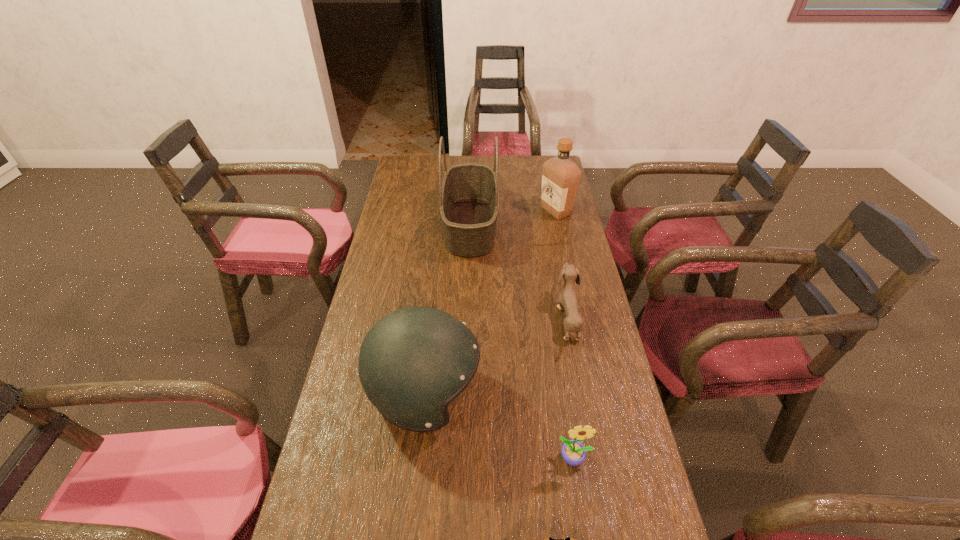
The height and width of the screenshot is (540, 960). What are the coordinates of `free space located 0.080m on the front-facing side of the sunflower` in the screenshot? It's located at (582, 508).

The width and height of the screenshot is (960, 540). Identify the location of free location located at the face of the third farthest object. (491, 319).

You are a GUI agent. You are given a task and a screenshot of the screen. Output one action in this format:
    pyautogui.click(x=<x>, y=<y>)
    Task: Click on the blank space located at the face of the third farthest object
    The width and height of the screenshot is (960, 540).
    Given the screenshot: What is the action you would take?
    pyautogui.click(x=474, y=319)

Where is `free space located 0.140m at the face of the third farthest object`? The image size is (960, 540). free space located 0.140m at the face of the third farthest object is located at coordinates (511, 319).

The image size is (960, 540). Find the location of `object present at the left edge`. object present at the left edge is located at coordinates (415, 361).

Where is `liquor at the right edge`? This screenshot has height=540, width=960. liquor at the right edge is located at coordinates (560, 175).

Where is `sunflower present at the right edge`? This screenshot has height=540, width=960. sunflower present at the right edge is located at coordinates (573, 452).

Find the location of a particular element. puppy present at the right edge is located at coordinates (568, 299).

The image size is (960, 540). In order to click on vacant space at the left edge of the desktop in this screenshot , I will do `click(417, 256)`.

Locate an element on the screen. The height and width of the screenshot is (540, 960). free space at the right edge of the desktop is located at coordinates (568, 400).